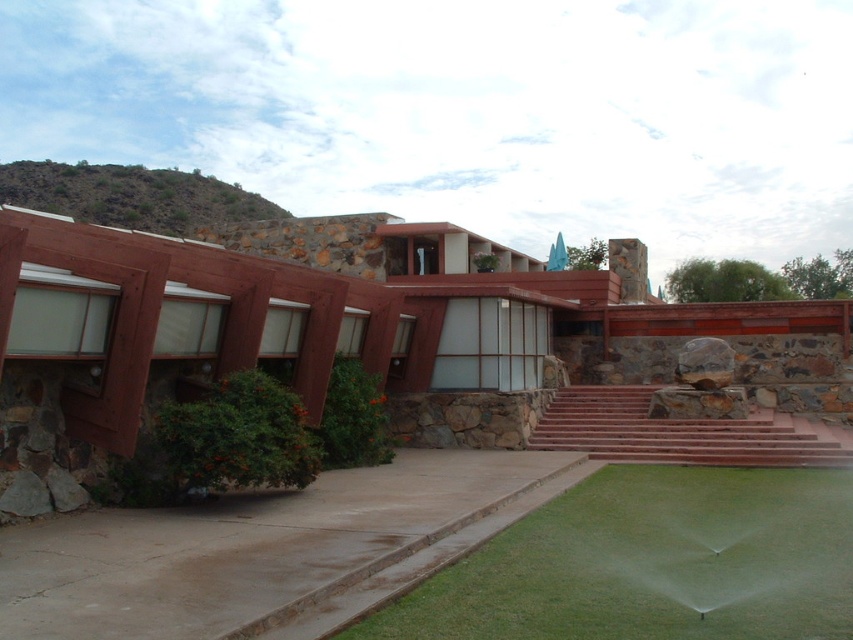
From the picture: You are standing at the entrance of the building and want to take a photo of both the point at coordinates (706, 445) and the point at coordinates (663, 632). Which point should you focus on first to ensure both are in focus?

You should focus on the point at coordinates (706, 445) first because it is closer to the camera than the point at coordinates (663, 632). This ensures both points will be in focus when using depth of field.

You are planning to install a new pathway that must be wider than the green grass at lower center. Can the brown wood pergola at center provide enough space for this pathway?

The brown wood pergola at center is wider than the green grass at lower center, so it can provide enough space for the pathway.

You are standing at the entrance of the building and want to walk towards the green grass at lower center. Which direction should you move relative to the brown wood pergola at center?

You should move behind the brown wood pergola at center to reach the green grass at lower center since the green grass at lower center is located behind it.